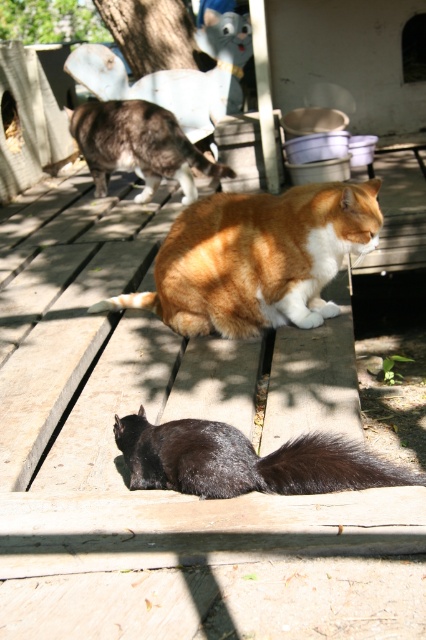
This screenshot has width=426, height=640. What do you see at coordinates (244, 460) in the screenshot?
I see `shiny black cat at lower center` at bounding box center [244, 460].

Can you confirm if shiny black cat at lower center is smaller than brown fur tail at lower center?

Actually, shiny black cat at lower center might be larger than brown fur tail at lower center.

Consider the image. Who is more distant from viewer, (337,470) or (120,301)?

Positioned behind is point (120,301).

This screenshot has height=640, width=426. Identify the location of shiny black cat at lower center. (244, 460).

This screenshot has height=640, width=426. What do you see at coordinates (328, 467) in the screenshot? I see `black silky tail at lower center` at bounding box center [328, 467].

This screenshot has height=640, width=426. I want to click on black silky tail at lower center, so click(328, 467).

In the scene shown: Between gray-furred cat at upper left and black silky tail at lower center, which one appears on the right side from the viewer's perspective?

black silky tail at lower center is more to the right.

Describe the element at coordinates (138, 147) in the screenshot. This screenshot has width=426, height=640. I see `gray-furred cat at upper left` at that location.

At what (x,y) coordinates should I click in order to perform the action: click on gray-furred cat at upper left. Please return your answer as a coordinate pair (x, y). This screenshot has height=640, width=426. Looking at the image, I should click on (138, 147).

I want to click on gray-furred cat at upper left, so click(x=138, y=147).